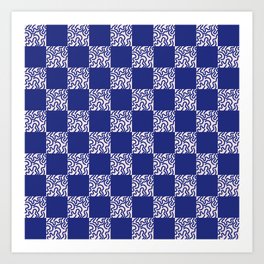
I want to click on checker board, so click(x=139, y=125).